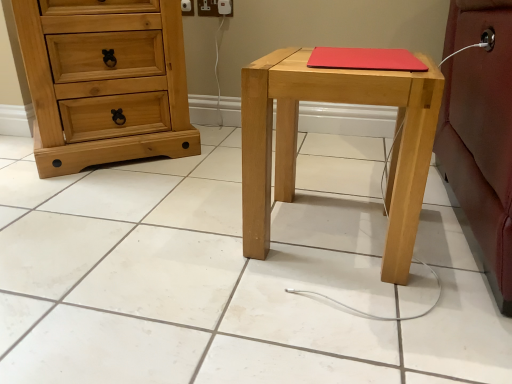
Locate an element on the screen. This screenshot has width=512, height=384. free space on the front side of natural wood stool at center is located at coordinates (344, 318).